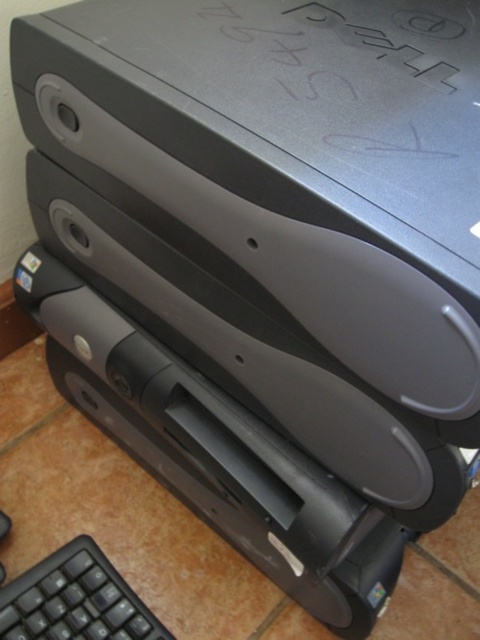
Is black matte text at upper center wider than black matte keyboard at lower left?

Yes.

Who is lower down, black matte text at upper center or black matte keyboard at lower left?

black matte keyboard at lower left is lower down.

Which is behind, point (336, 22) or point (137, 620)?

Point (137, 620)

Identify the location of black matte text at upper center. The image size is (480, 640). (346, 77).